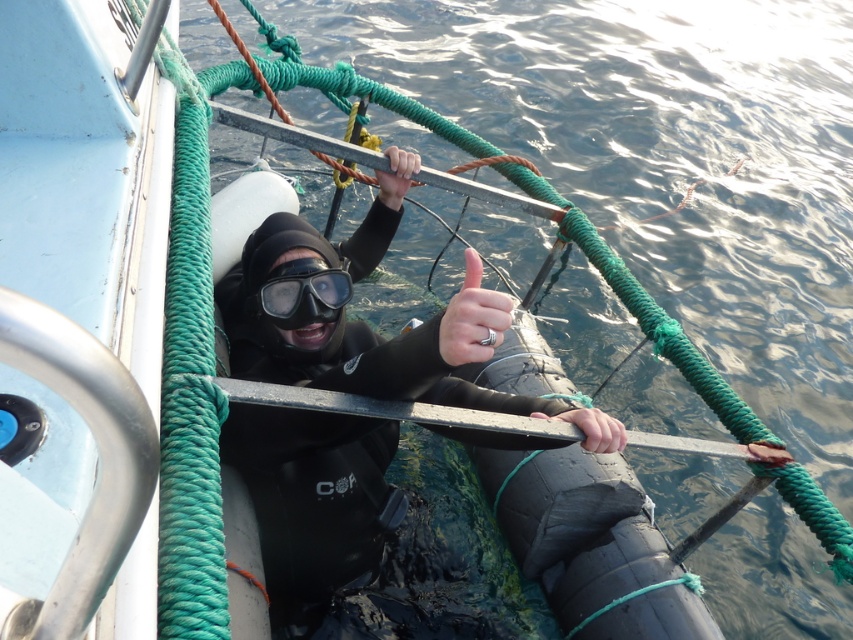
Looking at this image, which is above, black matte wetsuit at center or smooth black hand at center?

black matte wetsuit at center is above.

Is black matte wetsuit at center positioned before smooth black hand at center?

Yes, black matte wetsuit at center is in front of smooth black hand at center.

Does point (451, 435) come closer to viewer compared to point (596, 436)?

No, it is behind (596, 436).

Locate an element on the screen. This screenshot has width=853, height=640. black matte wetsuit at center is located at coordinates (316, 493).

Is silver metallic ring at center below matte black hand at upper center?

Yes, silver metallic ring at center is below matte black hand at upper center.

Consider the image. Does silver metallic ring at center have a smaller size compared to matte black hand at upper center?

Indeed, silver metallic ring at center has a smaller size compared to matte black hand at upper center.

Which is in front, point (451, 339) or point (387, 204)?

Point (451, 339) is more forward.

Image resolution: width=853 pixels, height=640 pixels. I want to click on silver metallic ring at center, so click(473, 317).

Which of these two, matte black hand at upper center or matte black hand at center, stands taller?

Result: matte black hand at upper center is taller.

Does matte black hand at upper center appear under matte black hand at center?

Incorrect, matte black hand at upper center is not positioned below matte black hand at center.

Between point (397, 170) and point (770, 465), which one is positioned behind?

The point (397, 170) is behind.

The height and width of the screenshot is (640, 853). I want to click on matte black hand at upper center, so click(x=396, y=176).